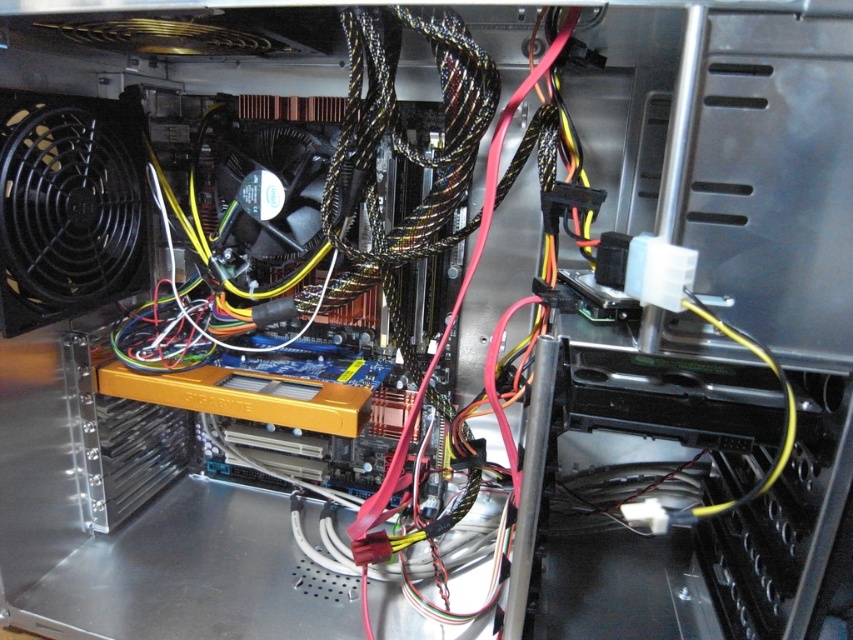
Question: Which point appears farthest from the camera in this image?

Choices:
 (A) (273, 150)
 (B) (20, 216)

Answer: (A)

Question: Which of the following is the closest to the observer?

Choices:
 (A) (41, 96)
 (B) (265, 138)

Answer: (A)

Question: Does black plastic fan at left appear over black plastic fan at center?

Choices:
 (A) yes
 (B) no

Answer: (B)

Question: Does black plastic fan at left appear over black plastic fan at center?

Choices:
 (A) yes
 (B) no

Answer: (B)

Question: Is black plastic fan at left closer to the viewer compared to black plastic fan at center?

Choices:
 (A) yes
 (B) no

Answer: (A)